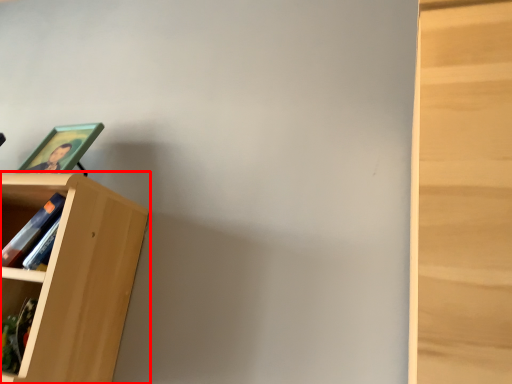
Question: From the image's perspective, considering the relative positions of bookcase (annotated by the red box) and picture frame in the image provided, where is bookcase (annotated by the red box) located with respect to the staircase?

Choices:
 (A) below
 (B) above

Answer: (A)